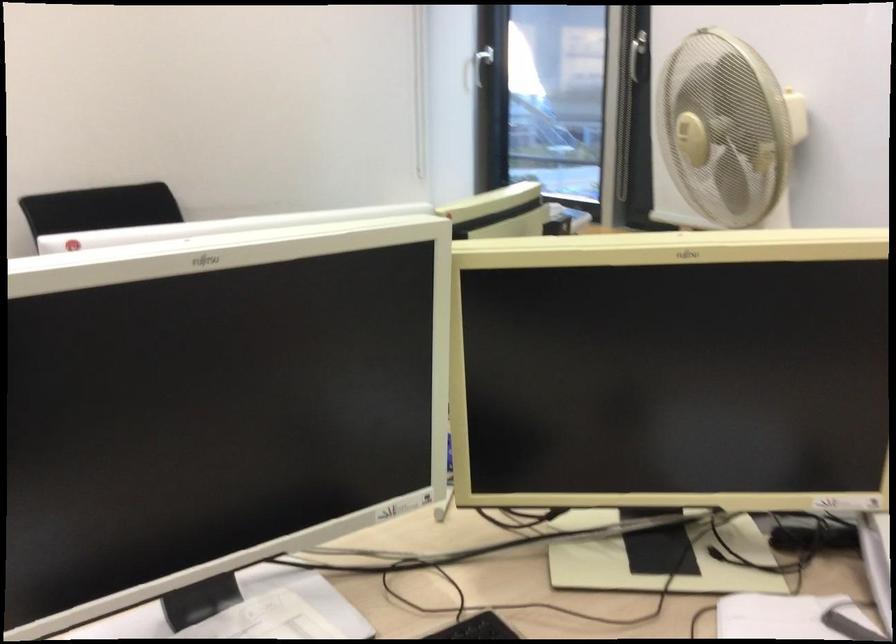
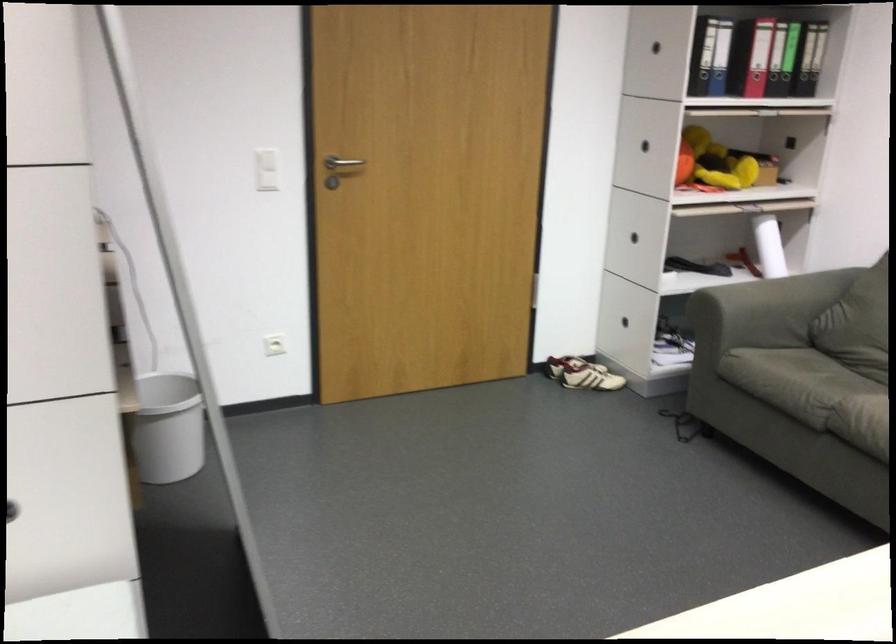
Based on the continuous images, in which direction is the camera rotating?

The camera's rotation is toward left-down.